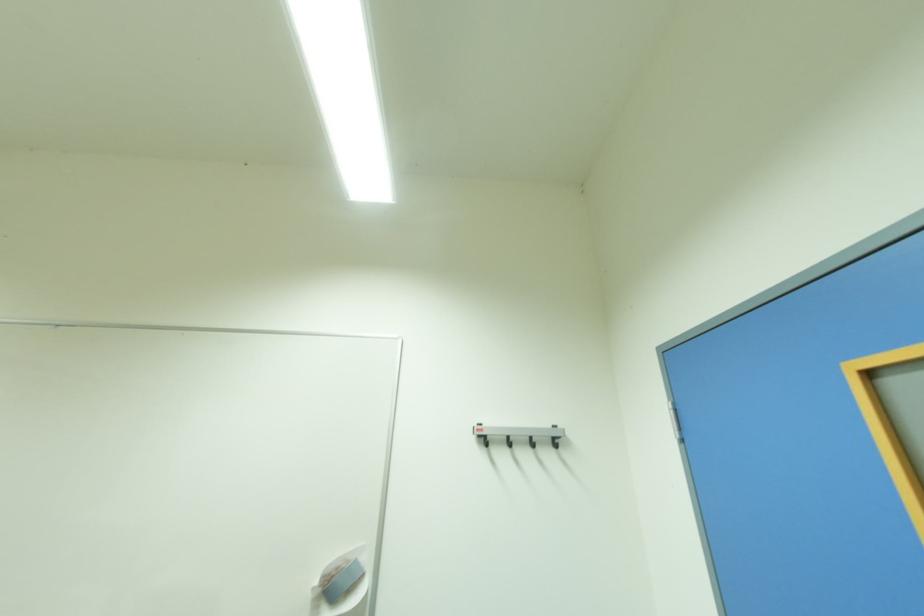
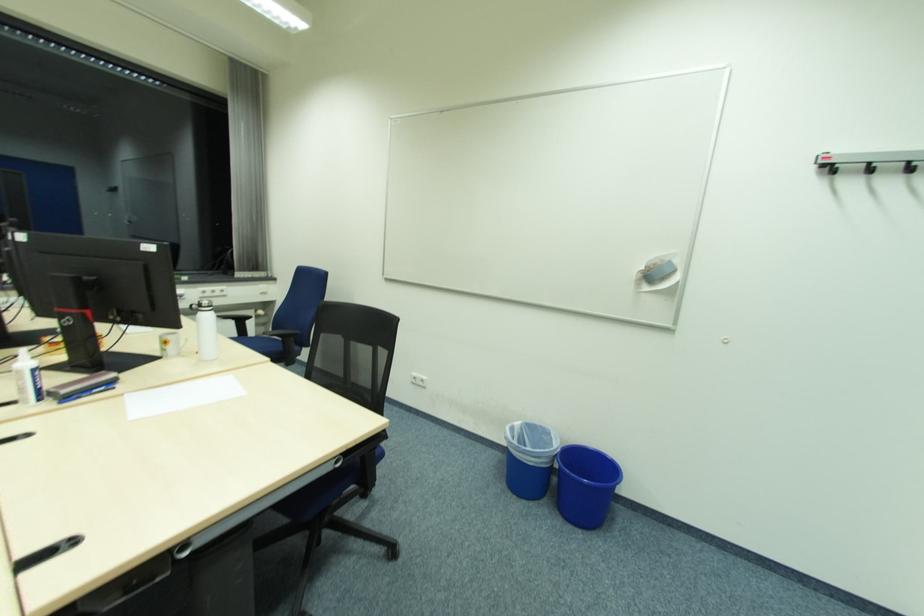
Based on the continuous images, in which direction is the camera rotating?

The camera rotated toward left-down.